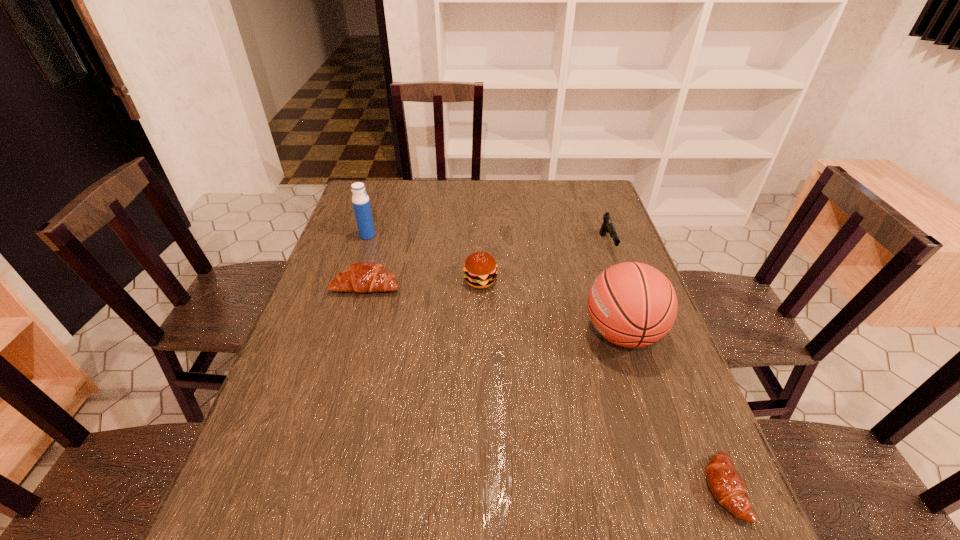
To make them evenly spaced by inserting another crescent_roll among them, please locate a vacant spot for this new crescent_roll. Please provide its 2D coordinates. Your answer should be formatted as a tuple, i.e. [(x, y)], where the tuple contains the x and y coordinates of a point satisfying the conditions above.

[(509, 366)]